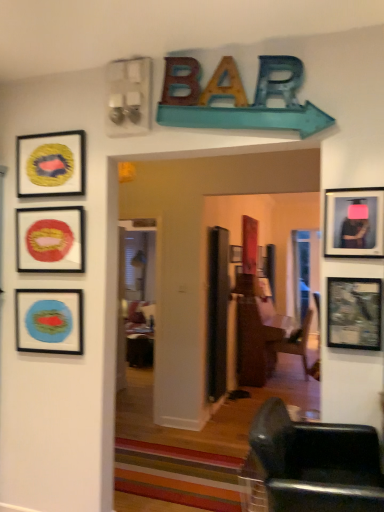
Identify the location of free spot above transparent glass door at center (from a real-world perspective). (135, 212).